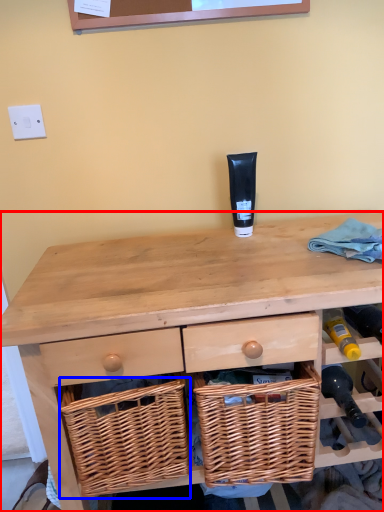
Question: Which object is closer to the camera taking this photo, desk (highlighted by a red box) or basket (highlighted by a blue box)?

Choices:
 (A) desk
 (B) basket

Answer: (A)